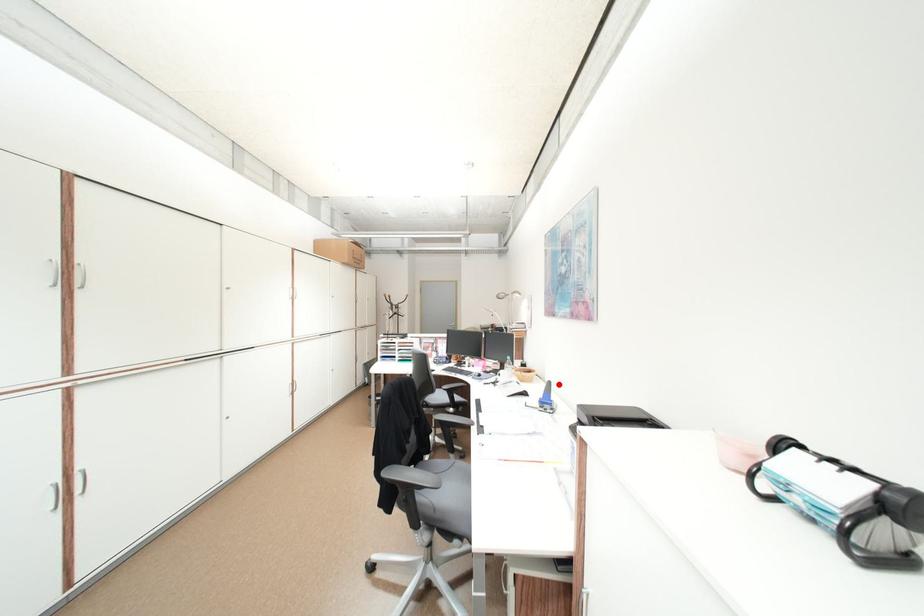
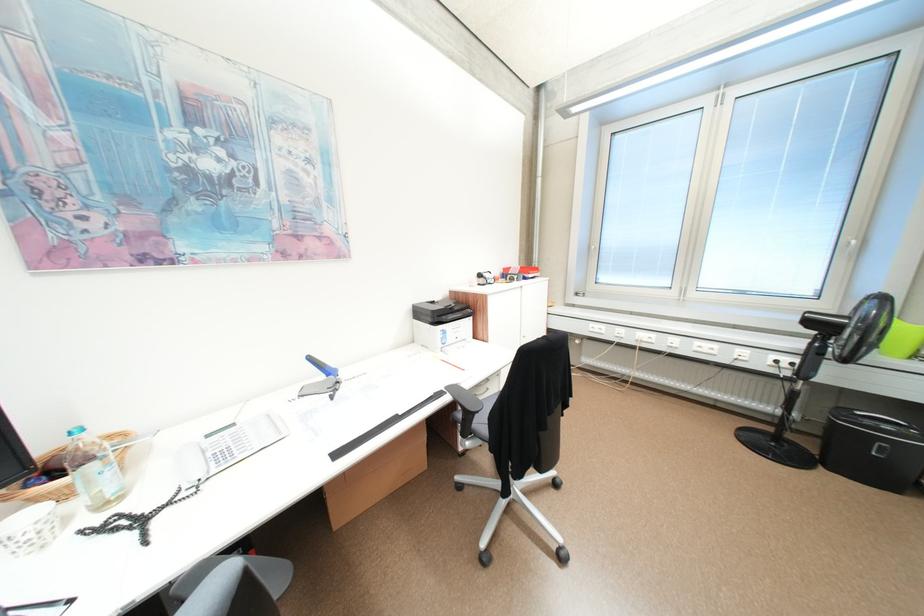
Question: I am providing you with two images of the same scene from different viewpoints. Given a red point in image1, look at the same physical point in image2. Is it:

Choices:
 (A) Closer to the viewpoint
 (B) Farther from the viewpoint

Answer: (B)